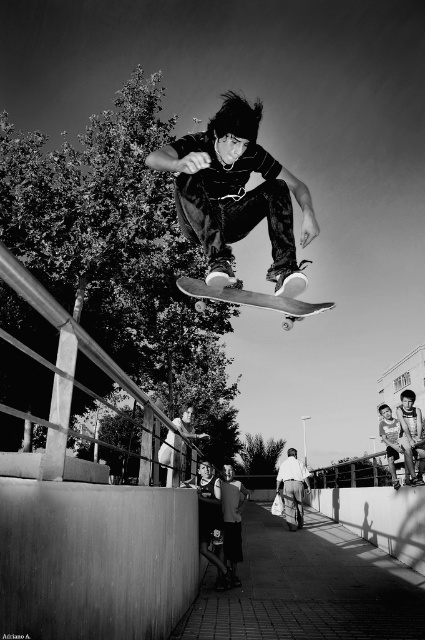
Question: Estimate the real-world distances between objects in this image. Which object is closer to the denim pants at lower center?

Choices:
 (A) matte black skateboard at center
 (B) wooden skateboard at center

Answer: (B)

Question: Is wooden skateboard at center to the right of denim pants at lower center from the viewer's perspective?

Choices:
 (A) no
 (B) yes

Answer: (A)

Question: Which object is farther from the camera taking this photo?

Choices:
 (A) denim pants at lower center
 (B) matte black skateboard at center
 (C) wooden skateboard at center

Answer: (A)

Question: Considering the real-world distances, which object is farthest from the wooden skateboard at center?

Choices:
 (A) matte black skateboard at center
 (B) denim pants at lower center

Answer: (B)

Question: Is matte black skateboard at center in front of denim pants at lower center?

Choices:
 (A) yes
 (B) no

Answer: (A)

Question: Does matte black skateboard at center appear over denim pants at lower center?

Choices:
 (A) yes
 (B) no

Answer: (A)